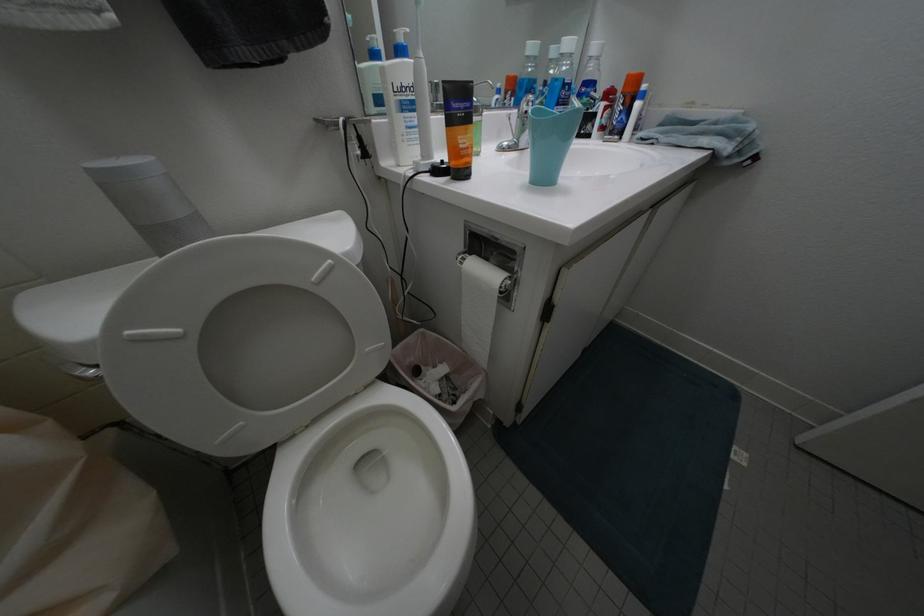
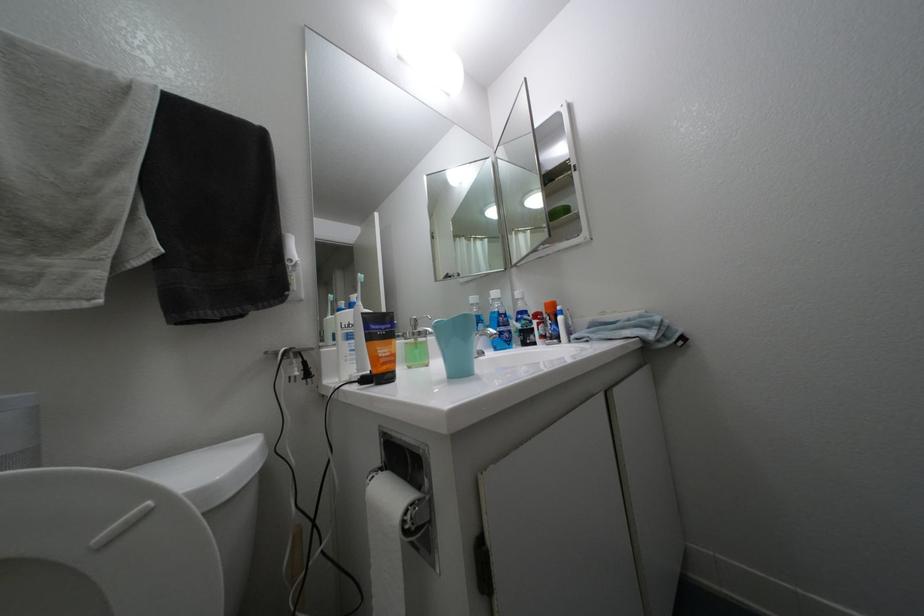
Question: The first image is from the beginning of the video and the second image is from the end. How did the camera likely rotate when shooting the video?

Choices:
 (A) Left
 (B) Right
 (C) Up
 (D) Down

Answer: (C)